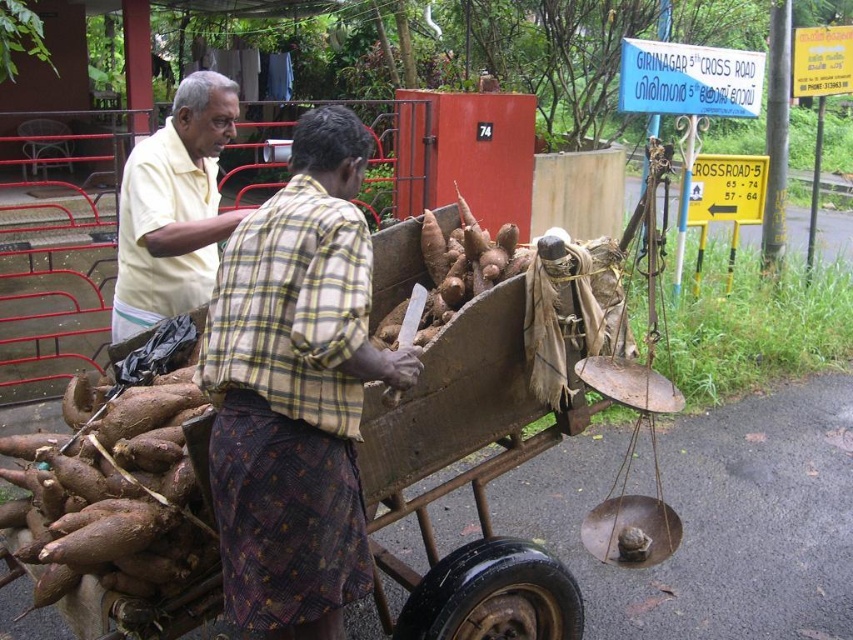
Question: Does yellow cotton shirt at center appear on the left side of yellow cotton shirt at upper left?

Choices:
 (A) no
 (B) yes

Answer: (A)

Question: Estimate the real-world distances between objects in this image. Which object is closer to the brown wooden cart at center?

Choices:
 (A) yellow cotton shirt at upper left
 (B) yellow cotton shirt at center

Answer: (B)

Question: Is yellow cotton shirt at center closer to camera compared to yellow cotton shirt at upper left?

Choices:
 (A) no
 (B) yes

Answer: (B)

Question: Which point is closer to the camera taking this photo?

Choices:
 (A) click(161, 259)
 (B) click(485, 531)
 (C) click(310, 116)

Answer: (C)

Question: Can you confirm if brown wooden cart at center is positioned above yellow cotton shirt at center?

Choices:
 (A) no
 (B) yes

Answer: (A)

Question: Which object is the closest to the brown wooden cart at center?

Choices:
 (A) yellow cotton shirt at upper left
 (B) yellow cotton shirt at center

Answer: (B)